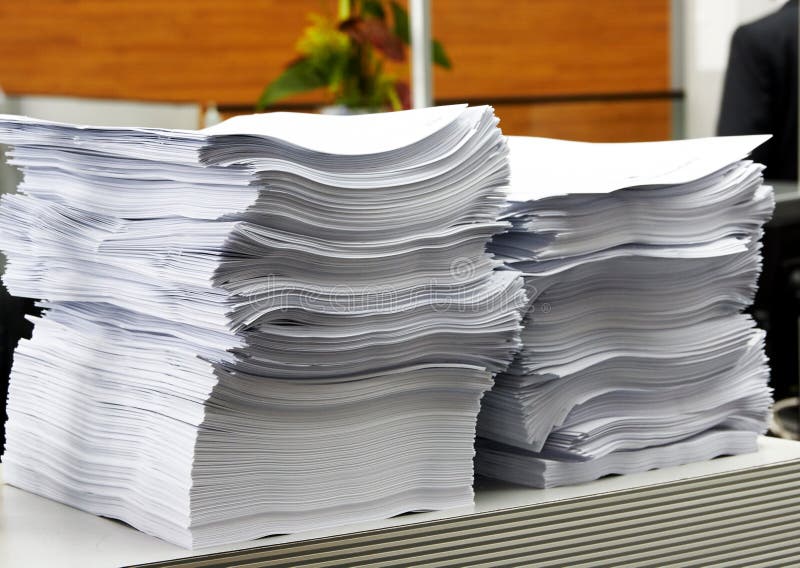
The height and width of the screenshot is (568, 800). I want to click on plant, so click(342, 64).